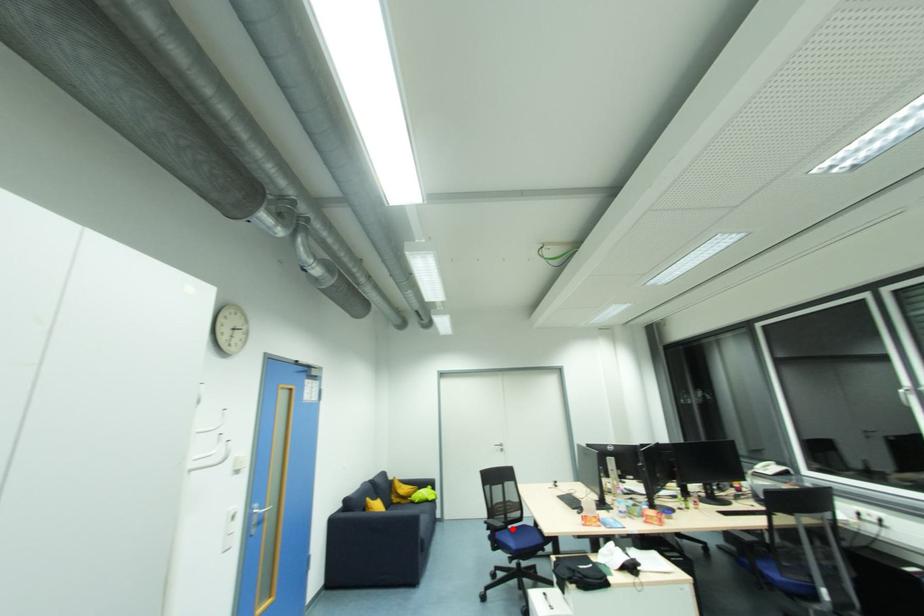
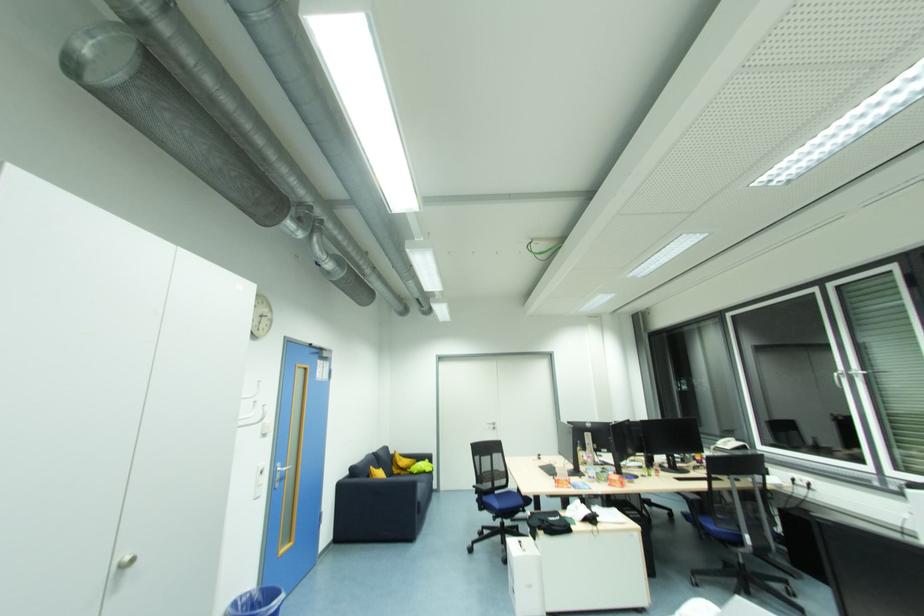
Where in the second image is the point corresponding to the highlighted location from the first image?

(500, 493)